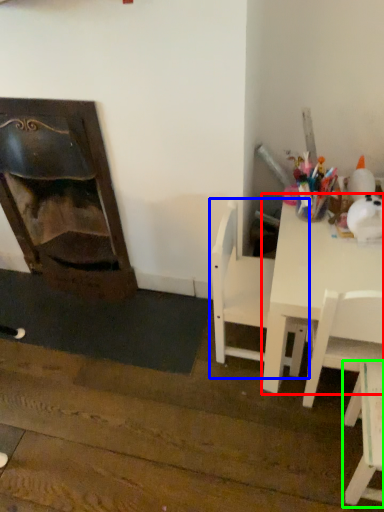
Question: Considering the real-world distances, which object is closest to table (highlighted by a red box)? chair (highlighted by a blue box) or chair (highlighted by a green box).

Choices:
 (A) chair
 (B) chair

Answer: (A)